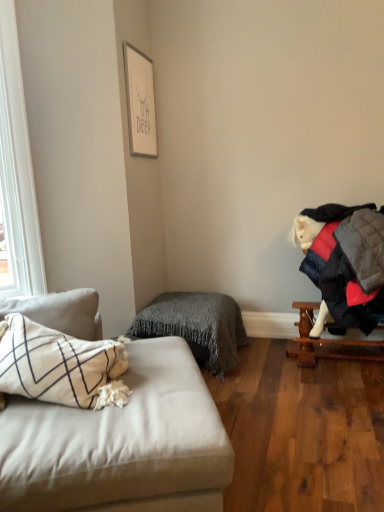
Question: Is gray fuzzy blanket at center taller than light gray fabric studio couch at left?

Choices:
 (A) no
 (B) yes

Answer: (A)

Question: Does gray fuzzy blanket at center touch light gray fabric studio couch at left?

Choices:
 (A) no
 (B) yes

Answer: (A)

Question: Is gray fuzzy blanket at center not within light gray fabric studio couch at left?

Choices:
 (A) no
 (B) yes

Answer: (B)

Question: Does gray fuzzy blanket at center have a greater width compared to light gray fabric studio couch at left?

Choices:
 (A) yes
 (B) no

Answer: (B)

Question: From the image's perspective, is gray fuzzy blanket at center beneath light gray fabric studio couch at left?

Choices:
 (A) yes
 (B) no

Answer: (B)

Question: Is gray fuzzy blanket at center bigger than light gray fabric studio couch at left?

Choices:
 (A) yes
 (B) no

Answer: (B)

Question: Could light gray fabric studio couch at left be considered to be inside wooden table at right?

Choices:
 (A) yes
 (B) no

Answer: (B)

Question: Is wooden table at right to the right of light gray fabric studio couch at left from the viewer's perspective?

Choices:
 (A) yes
 (B) no

Answer: (A)

Question: From the image's perspective, would you say wooden table at right is positioned over light gray fabric studio couch at left?

Choices:
 (A) yes
 (B) no

Answer: (A)

Question: Is wooden table at right bigger than light gray fabric studio couch at left?

Choices:
 (A) no
 (B) yes

Answer: (A)

Question: Is wooden table at right wider than light gray fabric studio couch at left?

Choices:
 (A) no
 (B) yes

Answer: (A)

Question: From a real-world perspective, is wooden table at right physically above light gray fabric studio couch at left?

Choices:
 (A) no
 (B) yes

Answer: (A)

Question: Considering the relative positions of wooden table at right and white matte picture frame at upper center in the image provided, is wooden table at right to the left of white matte picture frame at upper center from the viewer's perspective?

Choices:
 (A) no
 (B) yes

Answer: (A)